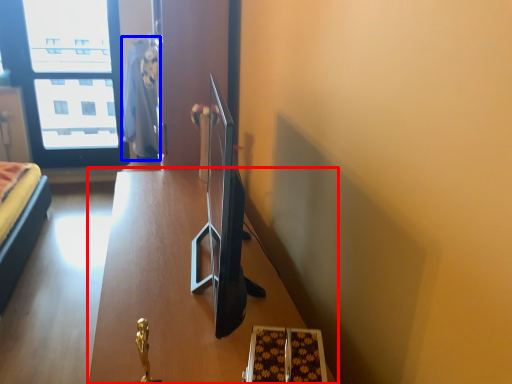
Question: Which point is further to the camera, table (highlighted by a red box) or robe (highlighted by a blue box)?

Choices:
 (A) table
 (B) robe

Answer: (B)